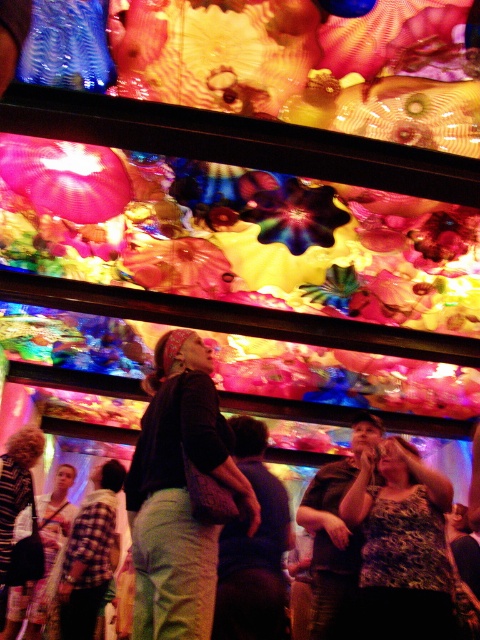
You are a photographer trying to capture both the matte black shirt at center and the leopard print tank top at center in a single shot. Which clothing item will appear larger in the photo?

The matte black shirt at center will appear larger in the photo because it has a larger size compared to the leopard print tank top at center.